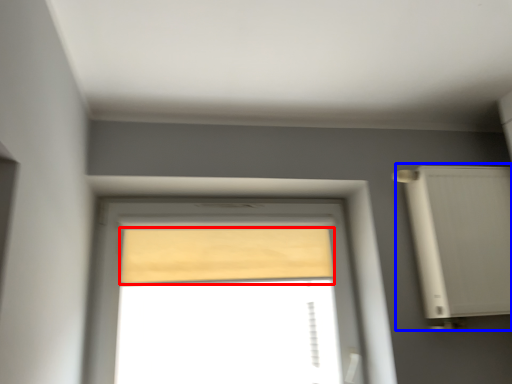
Question: Among these objects, which one is nearest to the camera, curtain (highlighted by a red box) or air conditioner (highlighted by a blue box)?

Choices:
 (A) curtain
 (B) air conditioner

Answer: (B)